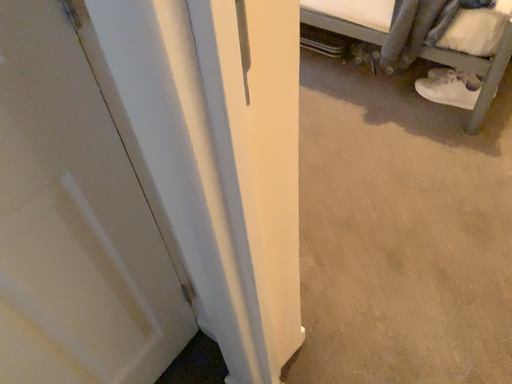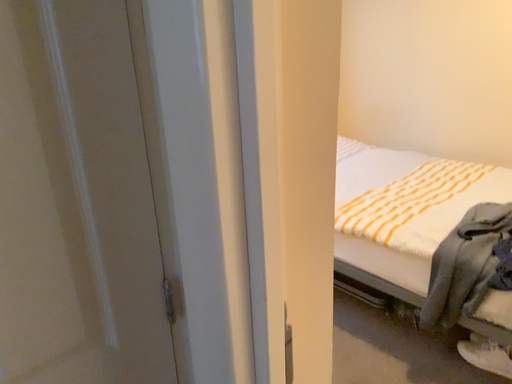
Question: How did the camera likely rotate when shooting the video?

Choices:
 (A) rotated upward
 (B) rotated downward

Answer: (A)